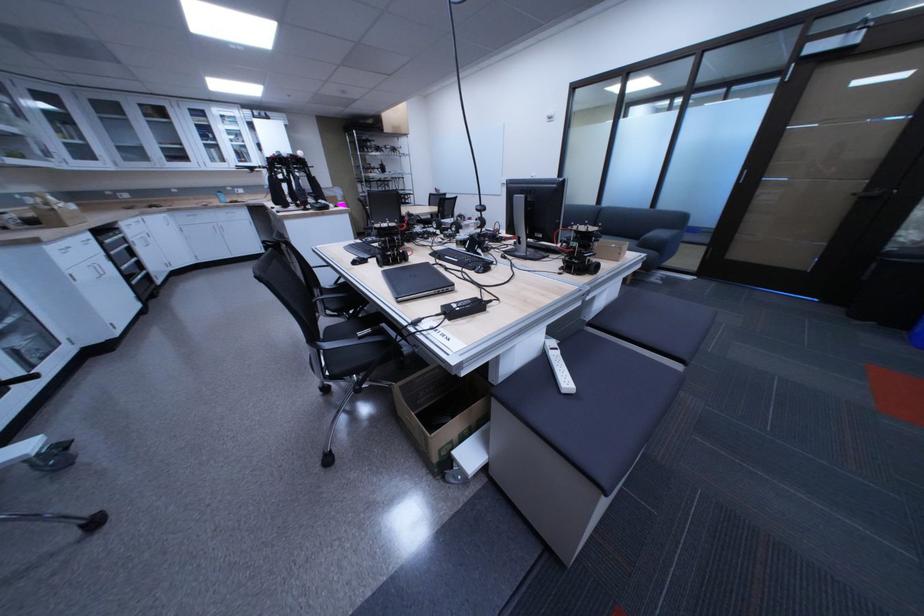
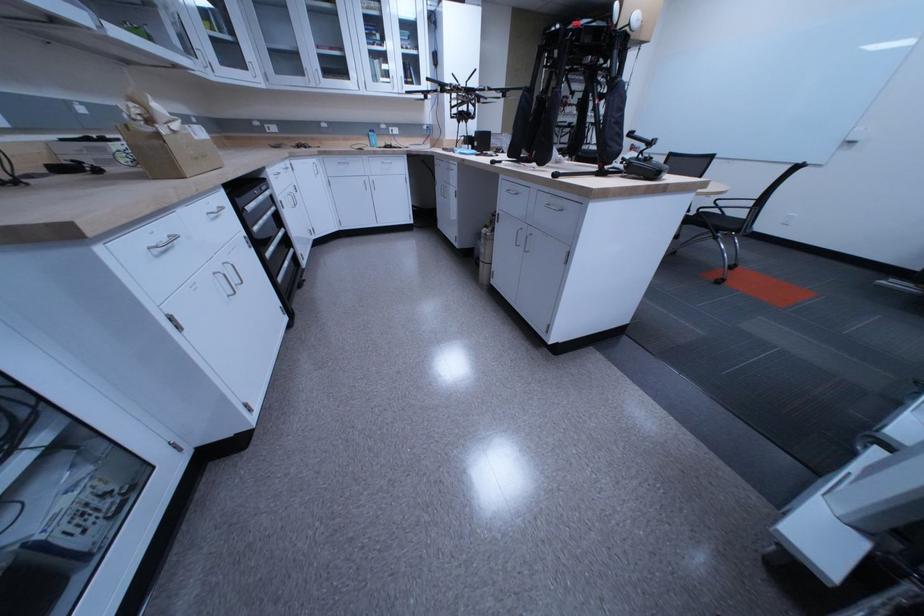
The point at (x=227, y=161) is marked in the first image. Where is the corresponding point in the second image?

(390, 79)